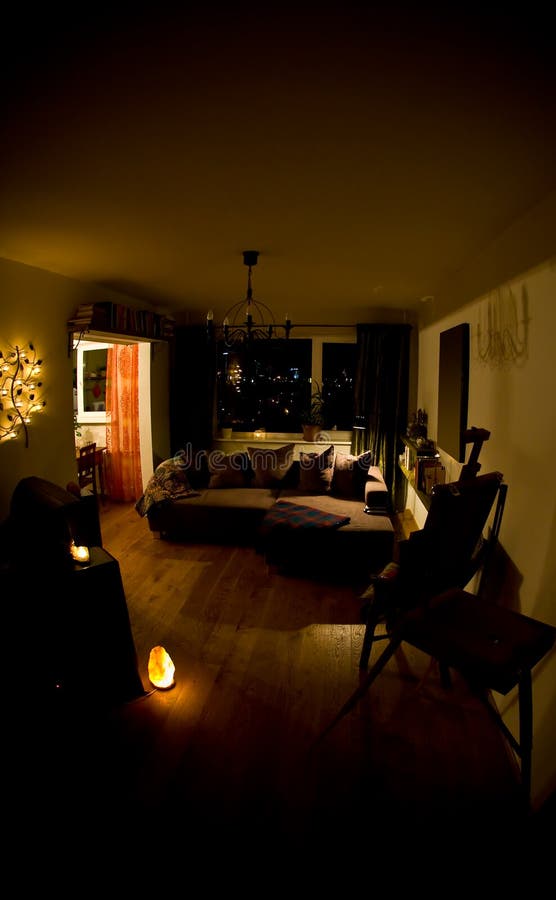
Where is `couch pillows`? This screenshot has width=556, height=900. couch pillows is located at coordinates (231, 475), (272, 472), (317, 481), (349, 481).